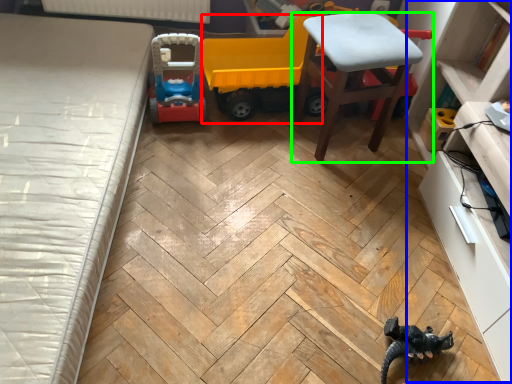
Question: Based on their relative distances, which object is nearer to model car (highlighted by a red box)? Choose from dresser (highlighted by a blue box) and chair (highlighted by a green box).

Choices:
 (A) dresser
 (B) chair

Answer: (B)